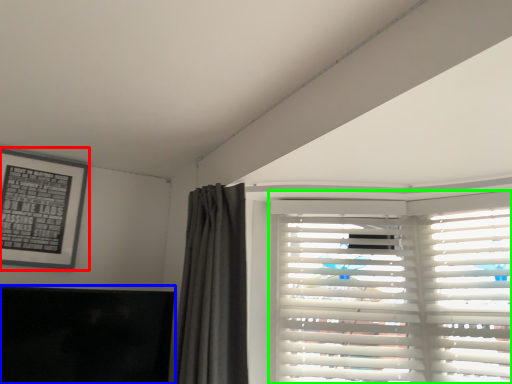
Question: Considering the real-world distances, which object is farthest from picture frame (highlighted by a red box)? window screen (highlighted by a blue box) or window blind (highlighted by a green box)?

Choices:
 (A) window screen
 (B) window blind

Answer: (B)